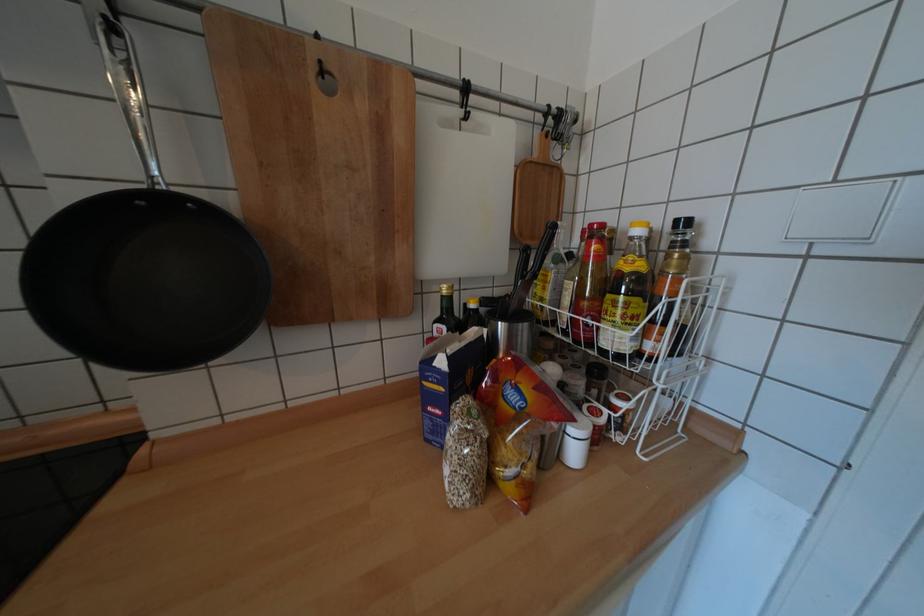
Find where to twist the black bottle cap. Please return your answer as a coordinate pair (x, y).

(682, 223)